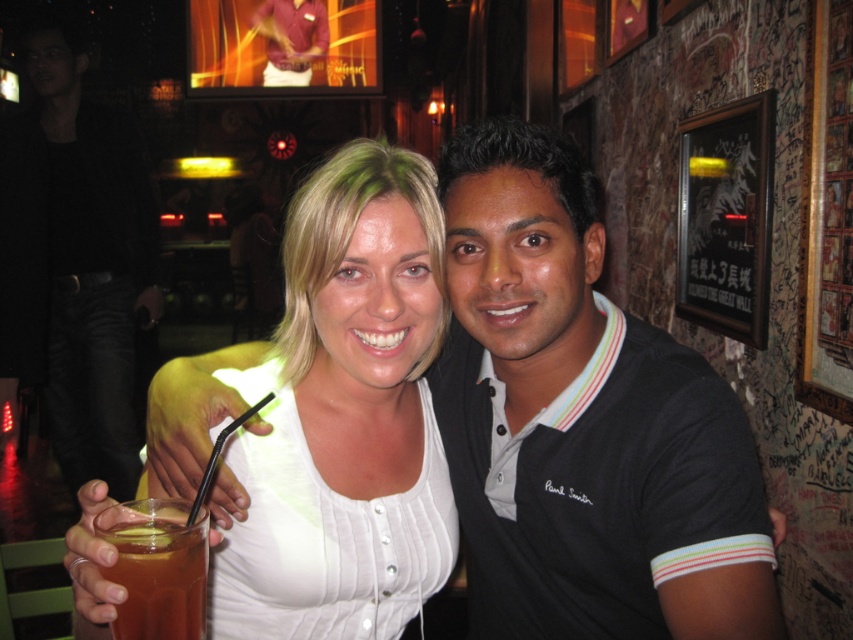
Question: Is translucent glass at lower left in front of translucent glass drink at lower left?

Choices:
 (A) yes
 (B) no

Answer: (B)

Question: Among these objects, which one is farthest from the camera?

Choices:
 (A) black cotton polo shirt at center
 (B) white matte tank top at center
 (C) translucent glass at lower left

Answer: (A)

Question: Can you confirm if white matte tank top at center is bigger than black cotton shirt at center?

Choices:
 (A) yes
 (B) no

Answer: (B)

Question: Which object is closer to the camera taking this photo?

Choices:
 (A) black cotton polo shirt at center
 (B) white matte tank top at center
 (C) black cotton shirt at center

Answer: (B)

Question: Which point appears closest to the camera in this image?

Choices:
 (A) (137, 605)
 (B) (105, 432)

Answer: (A)

Question: Can you confirm if white matte tank top at center is positioned above translucent glass at lower left?

Choices:
 (A) yes
 (B) no

Answer: (A)